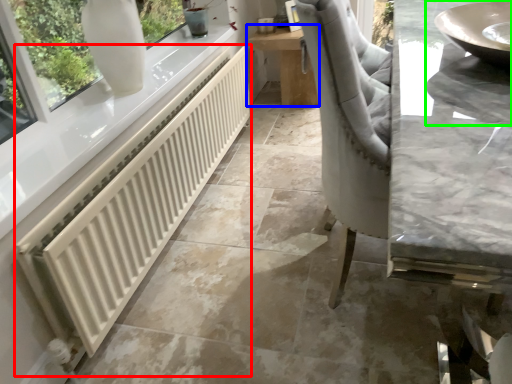
Question: Which object is positioned farthest from radiator (highlighted by a red box)? Select from table (highlighted by a blue box) and sink (highlighted by a green box).

Choices:
 (A) table
 (B) sink

Answer: (A)